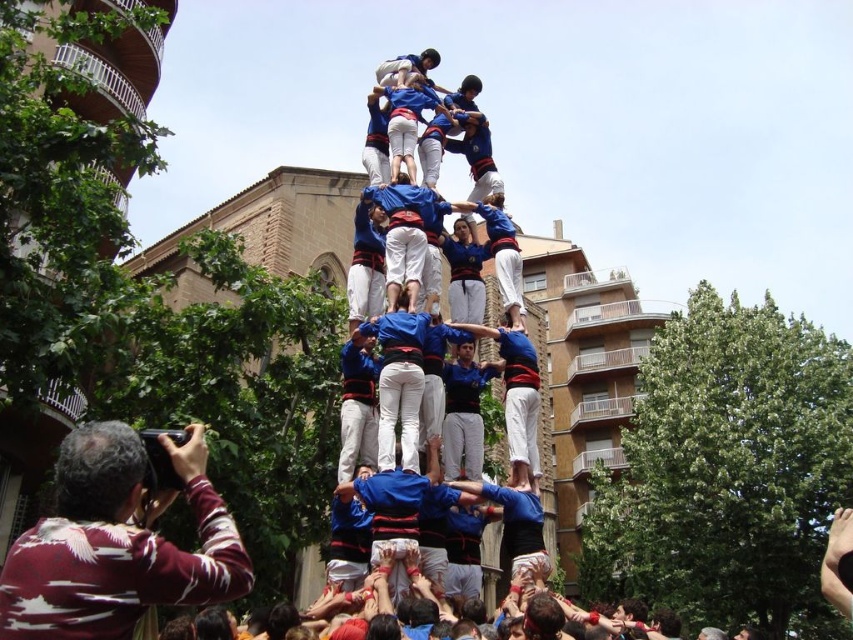
Consider the image. Who is positioned more to the right, maroon striped shirt at lower left or blue jersey at center?

blue jersey at center is more to the right.

Is point (219, 506) more distant than point (492, 163)?

No.

Find the location of a particular element. maroon striped shirt at lower left is located at coordinates point(115,544).

The image size is (853, 640). What are the coordinates of `maroon striped shirt at lower left` in the screenshot? It's located at (x=115, y=544).